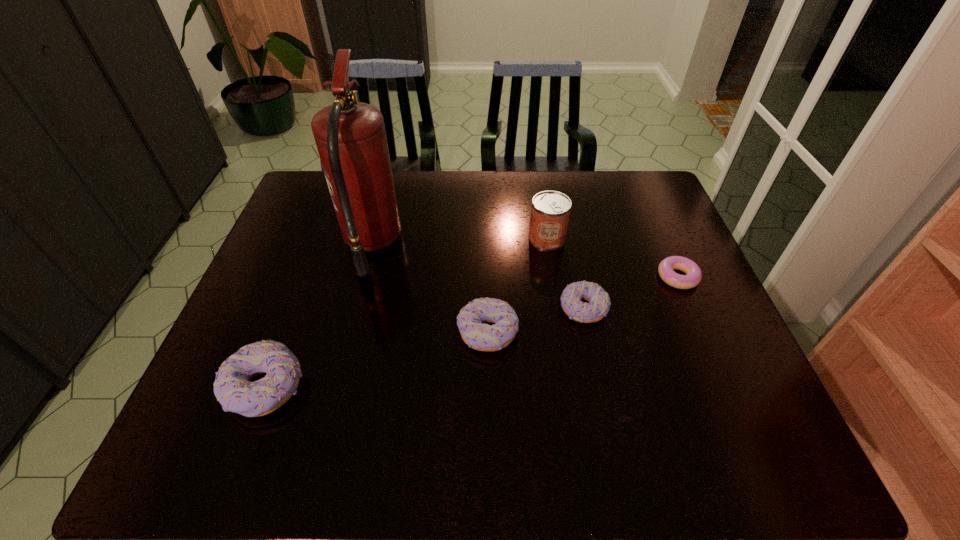
I want to click on the leftmost doughnut, so click(x=233, y=388).

Where is `the fourth object from right to left`? Image resolution: width=960 pixels, height=540 pixels. the fourth object from right to left is located at coordinates [x=471, y=321].

This screenshot has height=540, width=960. In order to click on the fourth tallest object in this screenshot , I will do `click(471, 321)`.

At what (x,y) coordinates should I click in order to perform the action: click on the second shortest object. Please return your answer as a coordinate pair (x, y). This screenshot has width=960, height=540. Looking at the image, I should click on (599, 303).

I want to click on the third doughnut from left to right, so click(x=599, y=303).

This screenshot has height=540, width=960. What are the coordinates of `the tallest object` in the screenshot? It's located at (350, 136).

The height and width of the screenshot is (540, 960). Identify the location of can. (550, 211).

Locate an element on the screen. the shortest doughnut is located at coordinates (693, 276).

Find the location of a particular element. the shortest object is located at coordinates (693, 276).

At what (x,y) coordinates should I click in order to perform the action: click on vacant region located on the right of the leftmost doughnut. Please return your answer as a coordinate pair (x, y). Looking at the image, I should click on (350, 387).